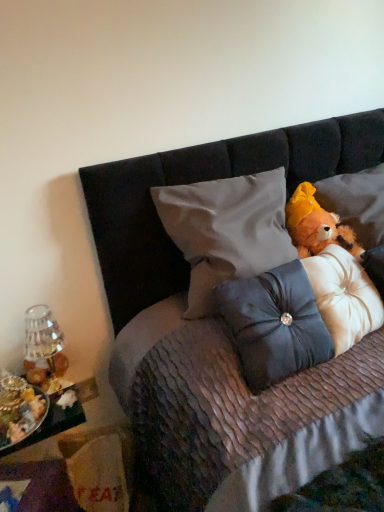
Question: Is transparent glass vase at left turned away from metallic silver tray at lower left?

Choices:
 (A) no
 (B) yes

Answer: (A)

Question: Is transparent glass vase at left completely or partially outside of metallic silver tray at lower left?

Choices:
 (A) no
 (B) yes

Answer: (B)

Question: Is transparent glass vase at left closer to camera compared to metallic silver tray at lower left?

Choices:
 (A) yes
 (B) no

Answer: (B)

Question: Are transparent glass vase at left and metallic silver tray at lower left far apart?

Choices:
 (A) no
 (B) yes

Answer: (A)

Question: Is transparent glass vase at left further to camera compared to metallic silver tray at lower left?

Choices:
 (A) yes
 (B) no

Answer: (A)

Question: Considering the relative positions of transparent glass vase at left and metallic silver tray at lower left in the image provided, is transparent glass vase at left to the right of metallic silver tray at lower left from the viewer's perspective?

Choices:
 (A) yes
 (B) no

Answer: (A)

Question: Would you say satin dark blue pillow at center, the second pillow from the right, is outside fluffy orange teddy bear at upper right?

Choices:
 (A) yes
 (B) no

Answer: (A)

Question: From the image's perspective, is satin dark blue pillow at center, the 2th pillow viewed from the left, located above fluffy orange teddy bear at upper right?

Choices:
 (A) no
 (B) yes

Answer: (A)

Question: Is satin dark blue pillow at center, the 2th pillow viewed from the left, thinner than fluffy orange teddy bear at upper right?

Choices:
 (A) no
 (B) yes

Answer: (A)

Question: Is satin dark blue pillow at center, the second pillow from the right, to the left of fluffy orange teddy bear at upper right from the viewer's perspective?

Choices:
 (A) yes
 (B) no

Answer: (A)

Question: Does satin dark blue pillow at center, the second pillow from the right, come behind fluffy orange teddy bear at upper right?

Choices:
 (A) yes
 (B) no

Answer: (B)

Question: Considering the relative sizes of satin dark blue pillow at center, the second pillow from the right, and fluffy orange teddy bear at upper right in the image provided, is satin dark blue pillow at center, the second pillow from the right, smaller than fluffy orange teddy bear at upper right?

Choices:
 (A) no
 (B) yes

Answer: (A)

Question: Can you confirm if transparent glass vase at left is bigger than satin gray pillow at center, acting as the 3th pillow starting from the right?

Choices:
 (A) no
 (B) yes

Answer: (A)